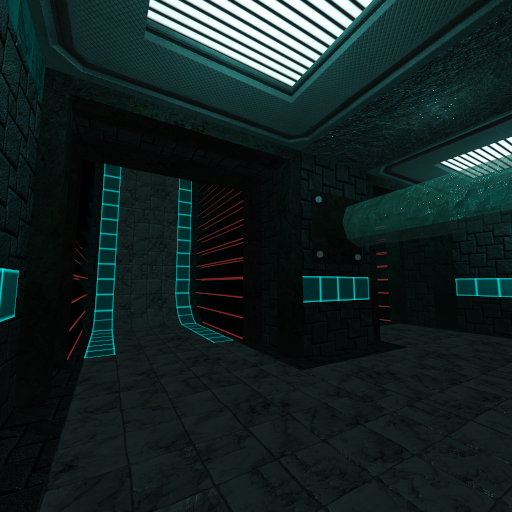
The height and width of the screenshot is (512, 512). I want to click on rightmost wall, so click(x=471, y=251).